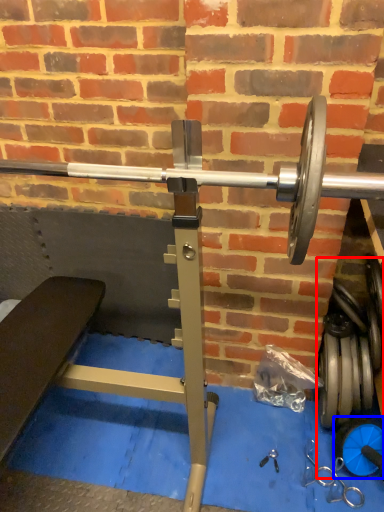
Question: Which object appears closest to the camera in this image, dumbbell (highlighted by a red box) or dumbbell (highlighted by a blue box)?

Choices:
 (A) dumbbell
 (B) dumbbell

Answer: (B)